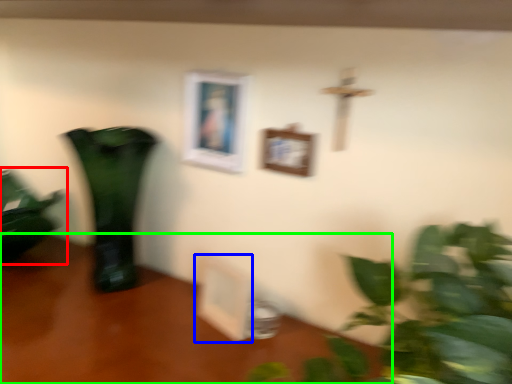
Question: Which is nearer to the houseplant (highlighted by a red box)? picture frame (highlighted by a blue box) or table (highlighted by a green box).

Choices:
 (A) picture frame
 (B) table

Answer: (B)